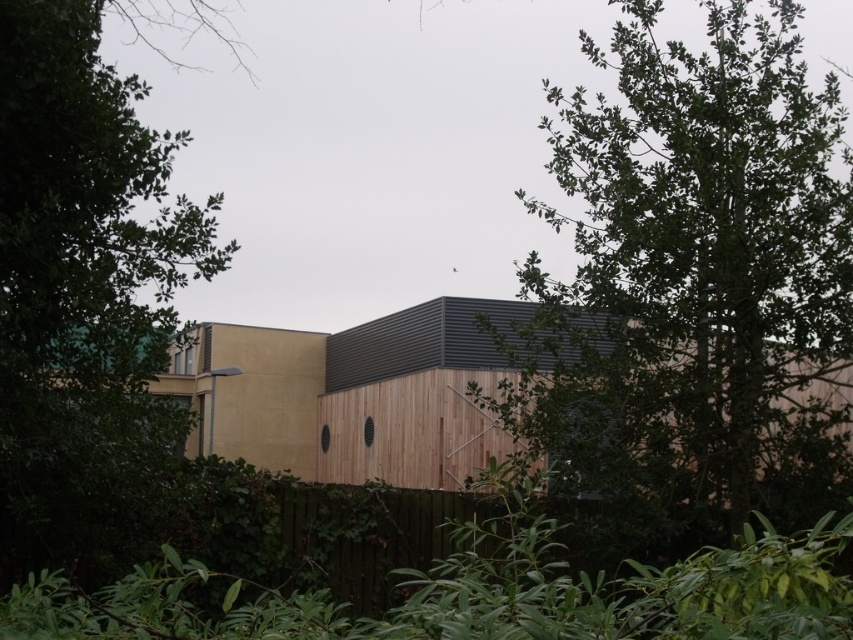
Question: Which point is farther to the camera?

Choices:
 (A) (593, 248)
 (B) (119, 104)

Answer: (A)

Question: Which of the following is the closest to the observer?

Choices:
 (A) green leafy tree at center
 (B) green leafy tree at left

Answer: (B)

Question: Does green leafy tree at center have a lesser width compared to green leafy tree at left?

Choices:
 (A) no
 (B) yes

Answer: (A)

Question: Does green leafy tree at center have a greater width compared to green leafy tree at left?

Choices:
 (A) no
 (B) yes

Answer: (B)

Question: Is green leafy tree at center below green leafy tree at left?

Choices:
 (A) yes
 (B) no

Answer: (B)